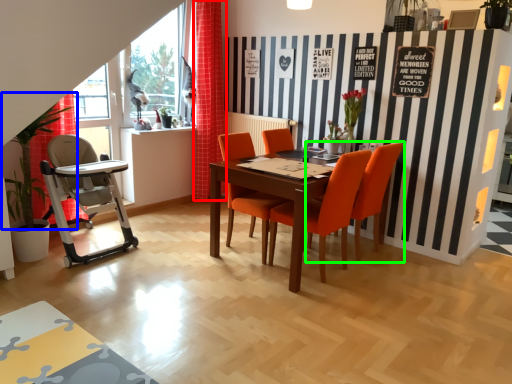
Question: Considering the real-world distances, which object is farthest from curtain (highlighted by a red box)? plant (highlighted by a blue box) or chair (highlighted by a green box)?

Choices:
 (A) plant
 (B) chair

Answer: (B)